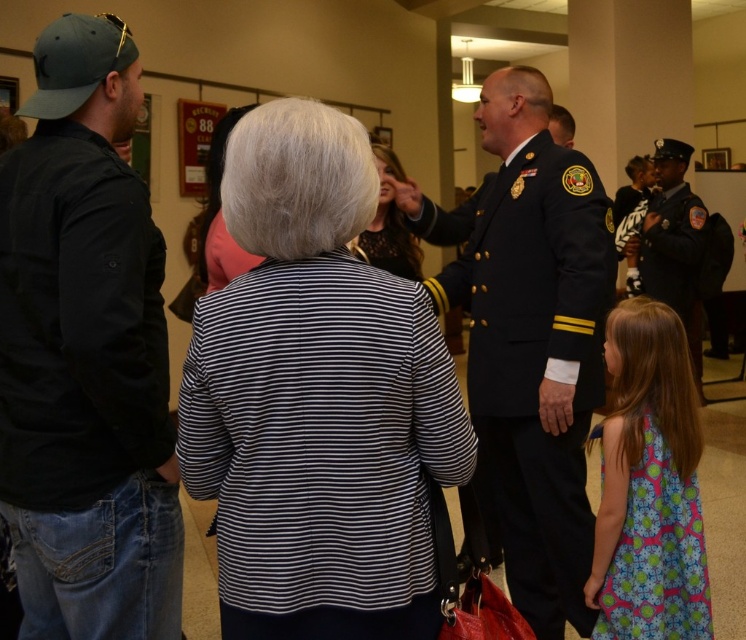
Question: Is black cotton jacket at left closer to the viewer compared to printed fabric dress at lower right?

Choices:
 (A) yes
 (B) no

Answer: (A)

Question: Is black cotton jacket at left closer to the viewer compared to printed fabric dress at lower right?

Choices:
 (A) no
 (B) yes

Answer: (B)

Question: Which point is closer to the camera?

Choices:
 (A) printed fabric dress at lower right
 (B) striped fabric jacket at center
 (C) dark blue uniform at right
 (D) dark blue uniform at center

Answer: (B)

Question: Among these points, which one is farthest from the camera?

Choices:
 (A) (636, 346)
 (B) (639, 260)
 (C) (56, 200)
 (D) (535, 314)

Answer: (B)

Question: Based on their relative distances, which object is nearer to the black lace dress at center?

Choices:
 (A) striped fabric jacket at center
 (B) printed fabric dress at lower right

Answer: (B)

Question: Can you confirm if black cotton jacket at left is wider than printed fabric dress at lower right?

Choices:
 (A) no
 (B) yes

Answer: (B)